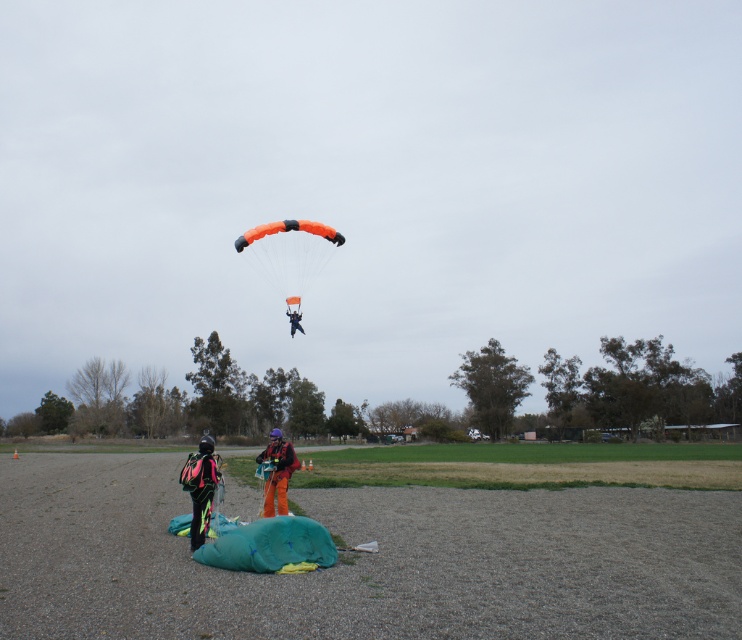
You are a photographer trying to capture the orange matte parachute at center and the orange fabric parachute at center in a single shot. Which parachute should you focus on first to ensure it appears sharp in the photo?

You should focus on the orange matte parachute at center first because it is closer to the viewer than the orange fabric parachute at center, making it the foreground object.

You are a photographer positioned at the edge of the skydiving area. You need to capture a photo where the orange matte parachute at center and the orange fabric parachute at upper center are both visible. Which parachute will appear larger in the photo?

The orange matte parachute at center will appear larger in the photo because it is closer to the viewer than the orange fabric parachute at upper center.